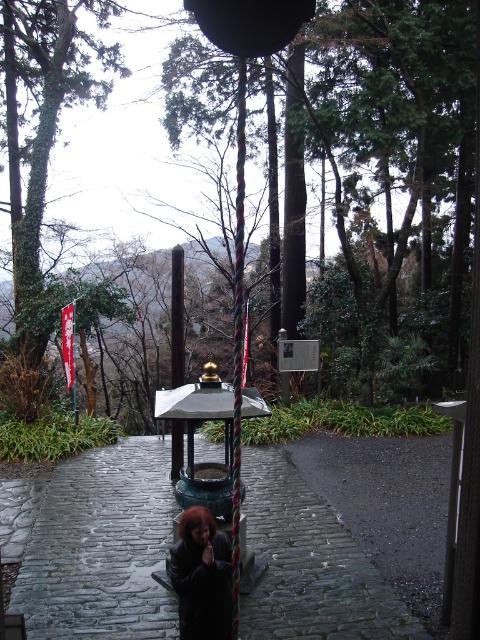
You are standing at the entrance of the garden and want to walk from the green leafy tree at center to the green patinated metal lantern at center. How many steps would you need to take if each step covers approximately 2.5 feet?

The distance between the green leafy tree at center and the green patinated metal lantern at center is 31.02 feet. Since each step covers about 2.5 feet, dividing 31.02 by 2.5 gives approximately 12.4 steps. Therefore, you would need to take around 12 to 13 steps to reach the lantern from the tree.

You are a visitor in the garden and want to take a photo of the green patinated metal lantern at center and the black polished pole at center. Which object should you focus on first if you want to capture both in a single frame without moving the camera?

The green patinated metal lantern at center is shorter than the black polished pole at center, so you should focus on the taller black polished pole at center first to ensure both are in frame.

You are standing at the entrance of the garden and want to find the green leafy tree at center. According to the coordinates provided, where should you look relative to the entrance?

The green leafy tree at center is located at coordinates point (385, 156), so you should look towards the center of the image slightly to the right and lower half of the scene.